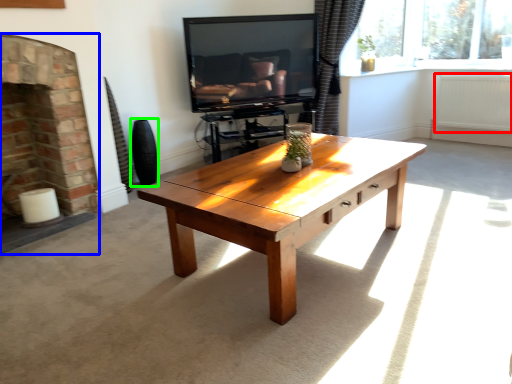
Question: Which object is the closest to the radiator (highlighted by a red box)? Choose among these: fireplace (highlighted by a blue box) or vase (highlighted by a green box).

Choices:
 (A) fireplace
 (B) vase

Answer: (B)